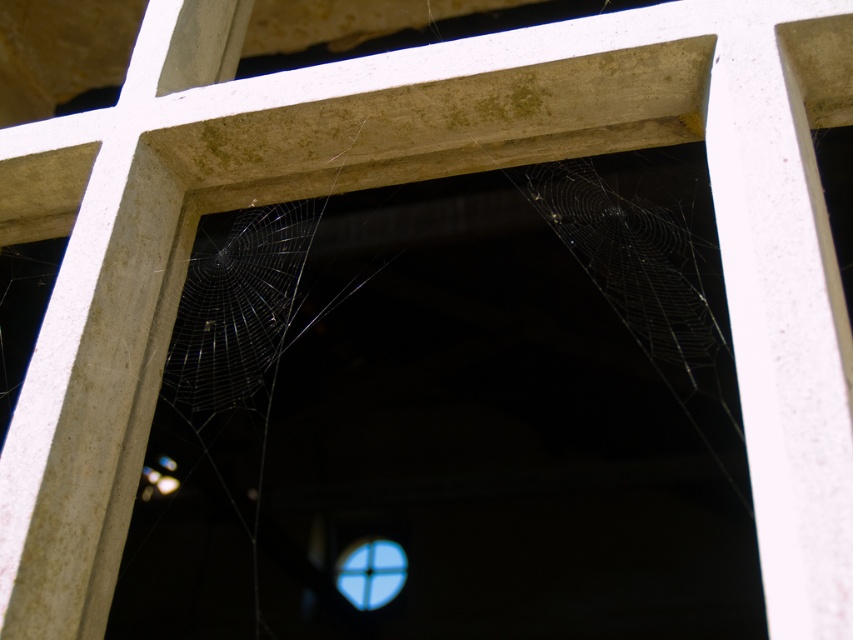
Question: Is the position of transparent silk web at center less distant than that of transparent glass window at center?

Choices:
 (A) yes
 (B) no

Answer: (A)

Question: Which point is farther to the camera?

Choices:
 (A) transparent glass window at center
 (B) transparent silk web at center

Answer: (A)

Question: Which of the following is the farthest from the observer?

Choices:
 (A) (404, 577)
 (B) (299, 227)

Answer: (A)

Question: Is transparent silk web at center behind transparent glass window at center?

Choices:
 (A) no
 (B) yes

Answer: (A)

Question: Which point appears closest to the camera in this image?

Choices:
 (A) (370, 557)
 (B) (264, 320)

Answer: (B)

Question: Can you confirm if transparent silk web at center is wider than transparent glass window at center?

Choices:
 (A) no
 (B) yes

Answer: (B)